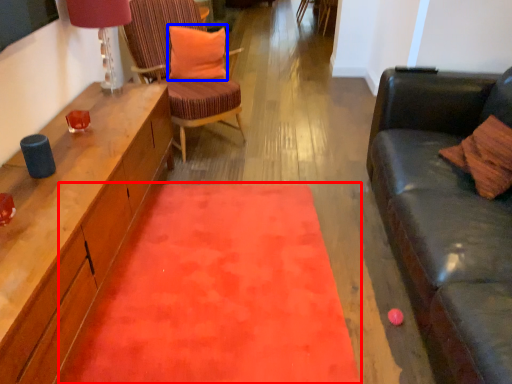
Question: Which object is further to the camera taking this photo, mat (highlighted by a red box) or pillow (highlighted by a blue box)?

Choices:
 (A) mat
 (B) pillow

Answer: (B)